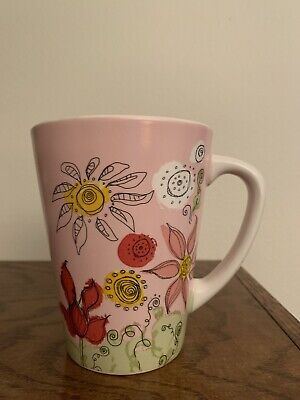
Locate an element on the screen. grey wall is located at coordinates (120, 64).